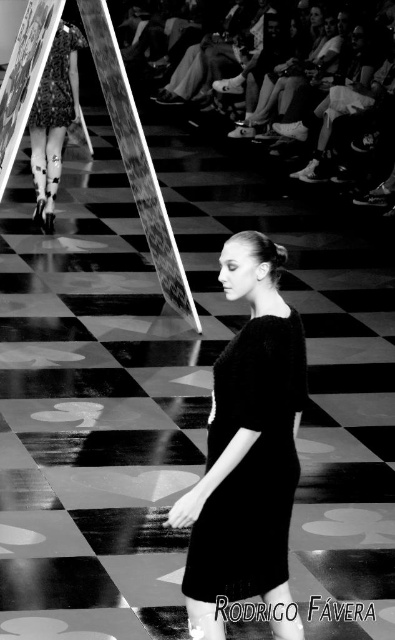
Question: Does matte black dress at center have a smaller size compared to printed fabric dress at upper left?

Choices:
 (A) yes
 (B) no

Answer: (A)

Question: Can you confirm if matte black dress at center is bigger than printed fabric dress at left?

Choices:
 (A) no
 (B) yes

Answer: (A)

Question: Which of the following is the farthest from the observer?

Choices:
 (A) matte black dress at center
 (B) printed fabric dress at upper left

Answer: (B)

Question: Estimate the real-world distances between objects in this image. Which object is farther from the printed fabric dress at left?

Choices:
 (A) matte black dress at center
 (B) printed fabric dress at upper left

Answer: (A)

Question: Which point appears closest to the camera in this image?

Choices:
 (A) (244, 499)
 (B) (47, 104)

Answer: (A)

Question: Does matte black dress at center appear on the left side of printed fabric dress at left?

Choices:
 (A) no
 (B) yes

Answer: (A)